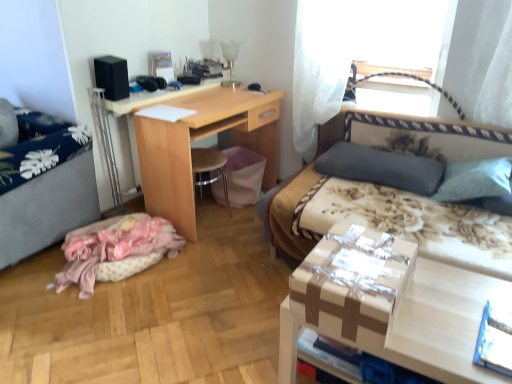
Locate an element on the screen. This screenshot has height=384, width=512. free space on the front side of pink fabric at lower left is located at coordinates (92, 330).